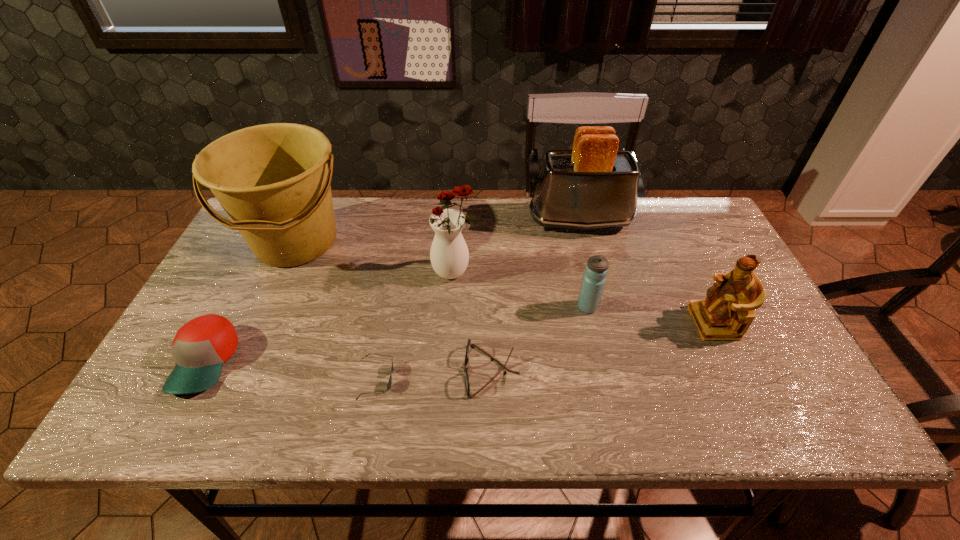
Identify the location of blank space located 0.290m on the side of the toaster with the control lever. (436, 220).

At what (x,y) coordinates should I click in order to perform the action: click on free space located on the side of the toaster with the control lever. Please return your answer as a coordinate pair (x, y). The width and height of the screenshot is (960, 540). Looking at the image, I should click on (417, 220).

In order to click on vacant point located 0.260m on the side of the toaster with the control lever in this screenshot , I will do `click(445, 220)`.

At what (x,y) coordinates should I click in order to perform the action: click on free spot located 0.310m on the side of the bucket with the handle. Please return your answer as a coordinate pair (x, y). This screenshot has width=960, height=540. Looking at the image, I should click on (234, 382).

Identify the location of vacant space located on the front of the vase. Image resolution: width=960 pixels, height=540 pixels. (446, 387).

Identify the location of free space located on the front-facing side of the fifth shortest object. This screenshot has width=960, height=540. (582, 322).

The width and height of the screenshot is (960, 540). I want to click on free location located on the front-facing side of the fifth shortest object, so click(658, 322).

The width and height of the screenshot is (960, 540). Find the location of `blank area located 0.290m on the front-facing side of the fifth shortest object`. blank area located 0.290m on the front-facing side of the fifth shortest object is located at coordinates (578, 322).

Locate an element on the screen. This screenshot has height=540, width=960. blank area located on the back of the fourth shortest object is located at coordinates (571, 238).

Locate an element on the screen. The height and width of the screenshot is (540, 960). free location located on the front-facing side of the second shortest object is located at coordinates (324, 371).